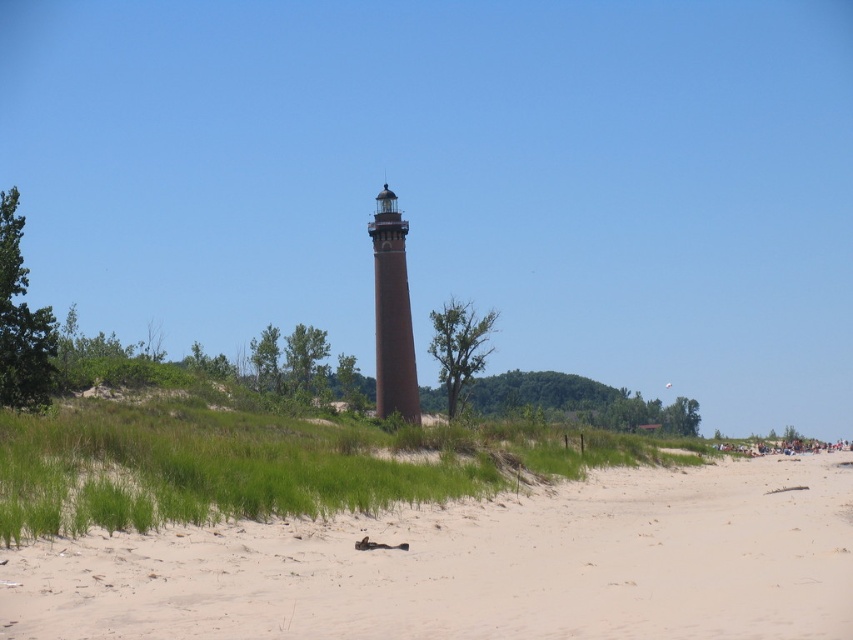
Does sandy beach at center appear on the right side of brown matte tower at center?

Correct, you'll find sandy beach at center to the right of brown matte tower at center.

I want to click on sandy beach at center, so click(479, 566).

Image resolution: width=853 pixels, height=640 pixels. Find the location of `sandy beach at center`. sandy beach at center is located at coordinates (479, 566).